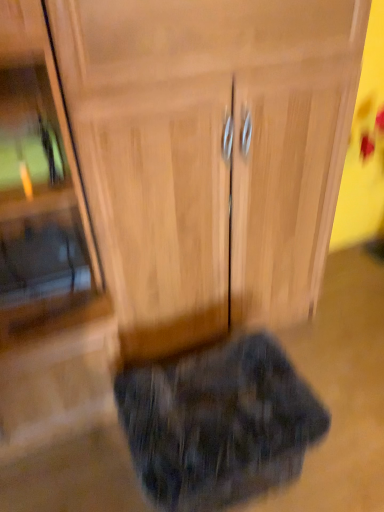
Question: Would you say wooden cabinet at center is inside or outside fluffy dark gray cat at lower center?

Choices:
 (A) inside
 (B) outside

Answer: (B)

Question: Considering the relative positions of wooden cabinet at center and fluffy dark gray cat at lower center in the image provided, is wooden cabinet at center to the left or to the right of fluffy dark gray cat at lower center?

Choices:
 (A) right
 (B) left

Answer: (B)

Question: Based on their relative distances, which object is nearer to the wooden cabinet at center?

Choices:
 (A) fluffy dark gray cat at lower center
 (B) wooden cabinet at center

Answer: (B)

Question: Which object is the farthest from the wooden cabinet at center?

Choices:
 (A) wooden cabinet at center
 (B) fluffy dark gray cat at lower center

Answer: (B)